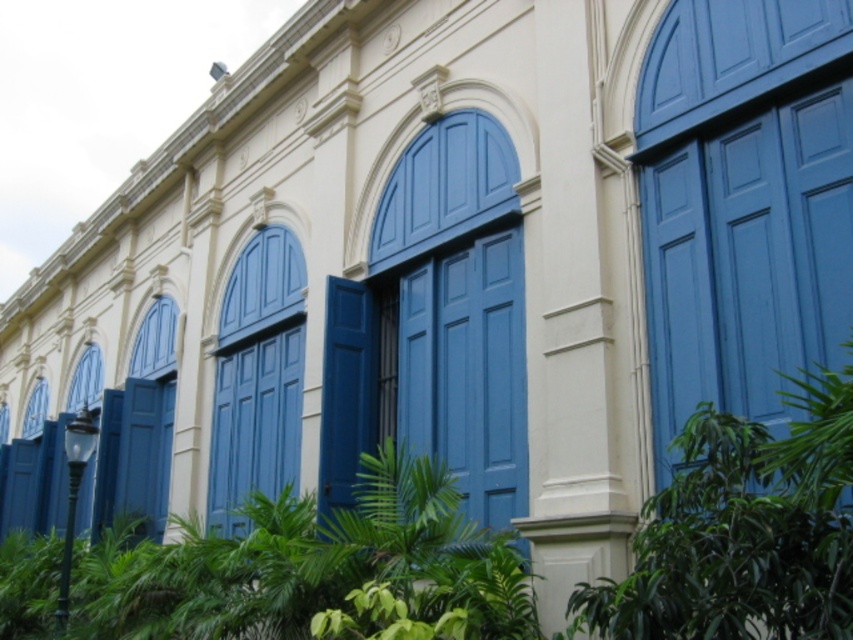
Question: Is matte blue door at center closer to the viewer compared to matte blue window at lower left?

Choices:
 (A) no
 (B) yes

Answer: (B)

Question: Which point appears closest to the camera in this image?

Choices:
 (A) (83, 362)
 (B) (231, 452)
 (C) (33, 394)
 (D) (801, 576)

Answer: (D)

Question: Which point is farther to the camera?

Choices:
 (A) green leafy plant at center
 (B) matte blue window at lower left

Answer: (B)

Question: Estimate the real-world distances between objects in this image. Which object is farther from the matte blue window at lower left?

Choices:
 (A) green leafy plant at center
 (B) matte blue door at center
 (C) green leafy plant at lower center
 (D) clear glass window at upper left

Answer: (A)

Question: Considering the relative positions of green leafy plant at lower center and matte blue door at center in the image provided, where is green leafy plant at lower center located with respect to matte blue door at center?

Choices:
 (A) right
 (B) left

Answer: (B)

Question: Can you confirm if matte blue door at center is thinner than clear glass window at upper left?

Choices:
 (A) yes
 (B) no

Answer: (A)